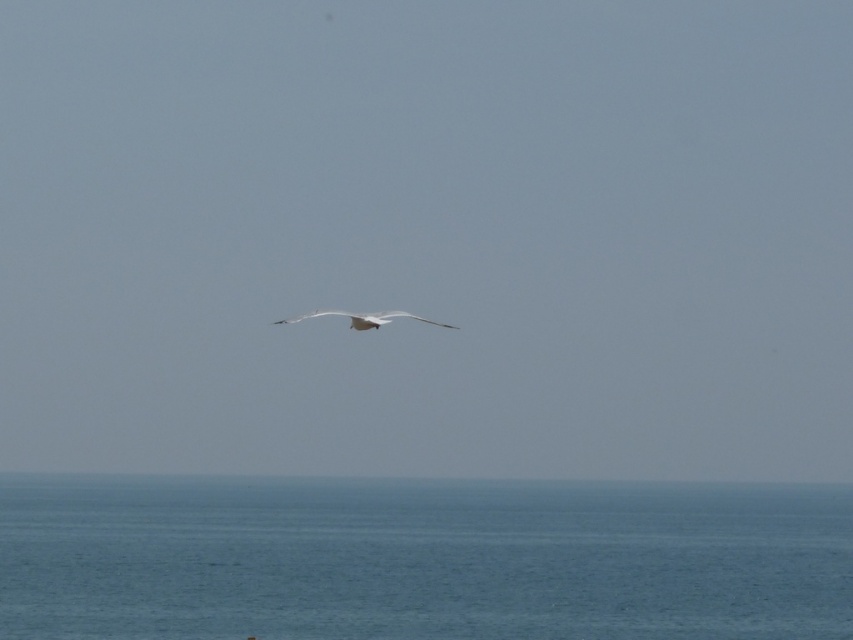
Question: Which of the following is the closest to the observer?

Choices:
 (A) (378, 316)
 (B) (33, 538)

Answer: (A)

Question: Which point is farther to the camera?

Choices:
 (A) blue water at lower center
 (B) white feathered bird at center

Answer: (A)

Question: Observing the image, what is the correct spatial positioning of blue water at lower center in reference to white feathered bird at center?

Choices:
 (A) above
 (B) below

Answer: (B)

Question: Is blue water at lower center closer to the viewer compared to white feathered bird at center?

Choices:
 (A) no
 (B) yes

Answer: (A)

Question: Is blue water at lower center wider than white feathered bird at center?

Choices:
 (A) yes
 (B) no

Answer: (A)